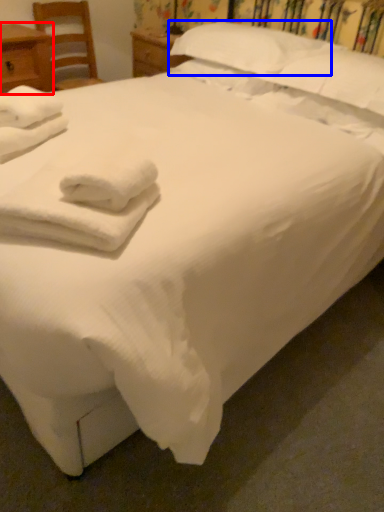
Question: Which object appears closest to the camera in this image, nightstand (highlighted by a red box) or pillow (highlighted by a blue box)?

Choices:
 (A) nightstand
 (B) pillow

Answer: (B)